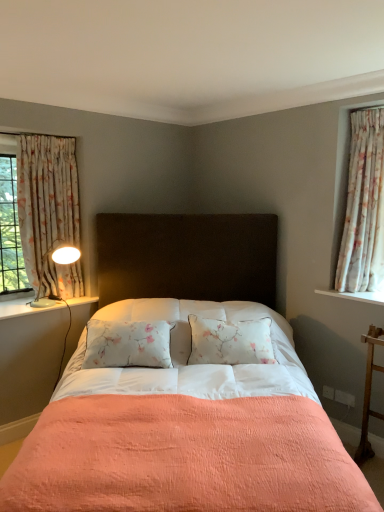
Question: Based on their positions, is white painted wood at left located to the left or right of floral fabric curtain at left, which appears as the 1th curtain when viewed from the left?

Choices:
 (A) left
 (B) right

Answer: (A)

Question: Considering the positions of white painted wood at left and floral fabric curtain at left, which appears as the 1th curtain when viewed from the left, in the image, is white painted wood at left taller or shorter than floral fabric curtain at left, which appears as the 1th curtain when viewed from the left,?

Choices:
 (A) tall
 (B) short

Answer: (B)

Question: Estimate the real-world distances between objects in this image. Which object is closer to the floral fabric curtain at left, the second curtain in the right-to-left sequence?

Choices:
 (A) white glossy lamp at left
 (B) floral fabric curtain at right, the second curtain from the left
 (C) peachy fabric bed at center
 (D) white painted wood at left

Answer: (A)

Question: Based on their relative distances, which object is nearer to the white glossy lamp at left?

Choices:
 (A) floral fabric curtain at left, which appears as the 1th curtain when viewed from the left
 (B) white painted wood at left
 (C) floral fabric curtain at right, the 1th curtain viewed from the right
 (D) peachy fabric bed at center

Answer: (B)